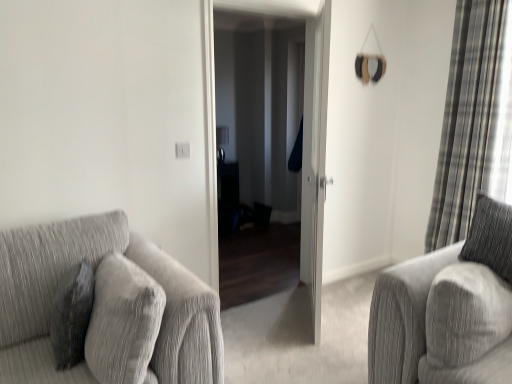
Identify the location of velvet dark gray pillow at left. (72, 315).

Image resolution: width=512 pixels, height=384 pixels. What do you see at coordinates (314, 157) in the screenshot?
I see `white glossy door at center, placed as the first screen door when sorted from right to left` at bounding box center [314, 157].

Where is `matte black screen door at center, the second screen door viewed from the right`? This screenshot has height=384, width=512. matte black screen door at center, the second screen door viewed from the right is located at coordinates (274, 7).

Measure the distance between matte black screen door at center, arranged as the 1th screen door when viewed from the left, and camera.

The depth of matte black screen door at center, arranged as the 1th screen door when viewed from the left, is 2.45 meters.

In order to face plaid fabric curtain at right, should I rotate leftwards or rightwards?

It's best to rotate right around 26.201 degrees.

What are the coordinates of `velvet dark gray pillow at left` in the screenshot? It's located at (72, 315).

Considering the sizes of objects velvet dark gray pillow at left and white glossy door at center, placed as the first screen door when sorted from right to left, in the image provided, who is bigger, velvet dark gray pillow at left or white glossy door at center, placed as the first screen door when sorted from right to left,?

Bigger between the two is white glossy door at center, placed as the first screen door when sorted from right to left.

Is white glossy door at center, placed as the second screen door when sorted from left to right, at the back of velvet dark gray pillow at left?

Yes, velvet dark gray pillow at left is facing away from white glossy door at center, placed as the second screen door when sorted from left to right.

From the image's perspective, is velvet dark gray pillow at left located beneath white glossy door at center, placed as the first screen door when sorted from right to left?

Yes.

From a real-world perspective, is velvet dark gray pillow at left positioned above or below white glossy door at center, placed as the first screen door when sorted from right to left?

velvet dark gray pillow at left is below white glossy door at center, placed as the first screen door when sorted from right to left.

From a real-world perspective, does white glossy door at center, placed as the second screen door when sorted from left to right, stand above plaid fabric curtain at right?

No, from a real-world perspective, white glossy door at center, placed as the second screen door when sorted from left to right, is not on top of plaid fabric curtain at right.

Is white glossy door at center, placed as the second screen door when sorted from left to right, to the right of plaid fabric curtain at right from the viewer's perspective?

No, white glossy door at center, placed as the second screen door when sorted from left to right, is not to the right of plaid fabric curtain at right.

Can you tell me how much white glossy door at center, placed as the second screen door when sorted from left to right, and plaid fabric curtain at right differ in facing direction?

The angle between the facing direction of white glossy door at center, placed as the second screen door when sorted from left to right, and the facing direction of plaid fabric curtain at right is 35.5 degrees.

Does matte black screen door at center, the second screen door viewed from the right, have a lesser height compared to velvet dark gray pillow at left?

In fact, matte black screen door at center, the second screen door viewed from the right, may be taller than velvet dark gray pillow at left.

The height and width of the screenshot is (384, 512). I want to click on pillow below the matte black screen door at center, arranged as the 1th screen door when viewed from the left (from a real-world perspective), so pos(72,315).

Does point (311, 21) come closer to viewer compared to point (78, 336)?

No, (311, 21) is further to viewer.

Is matte black screen door at center, arranged as the 1th screen door when viewed from the left, smaller than velvet dark gray pillow at left?

No, matte black screen door at center, arranged as the 1th screen door when viewed from the left, is not smaller than velvet dark gray pillow at left.

What's the angular difference between velvet dark gray pillow at left and plaid fabric curtain at right's facing directions?

The angular difference between velvet dark gray pillow at left and plaid fabric curtain at right is 9.28 degrees.

Is point (69, 277) farther from camera compared to point (461, 222)?

No, (69, 277) is closer to viewer.

Based on the photo, from the image's perspective, relative to plaid fabric curtain at right, is velvet dark gray pillow at left above or below?

velvet dark gray pillow at left is situated lower than plaid fabric curtain at right in the image.

Would you say velvet dark gray pillow at left is to the left or to the right of plaid fabric curtain at right in the picture?

Clearly, velvet dark gray pillow at left is on the left of plaid fabric curtain at right in the image.

Is plaid fabric curtain at right facing towards white glossy door at center, placed as the second screen door when sorted from left to right?

Yes, plaid fabric curtain at right is aimed at white glossy door at center, placed as the second screen door when sorted from left to right.

Which is closer to the camera, (473,60) or (302,227)?

Point (473,60) is positioned closer to the camera compared to point (302,227).

Is plaid fabric curtain at right next to white glossy door at center, placed as the first screen door when sorted from right to left, and touching it?

No, plaid fabric curtain at right is not making contact with white glossy door at center, placed as the first screen door when sorted from right to left.

From the image's perspective, which object appears higher, plaid fabric curtain at right or white glossy door at center, placed as the first screen door when sorted from right to left?

plaid fabric curtain at right appears higher in the image.

From the image's perspective, is plaid fabric curtain at right on velvet dark gray pillow at left?

Yes, from the image's perspective, plaid fabric curtain at right is over velvet dark gray pillow at left.

Is plaid fabric curtain at right wider or thinner than velvet dark gray pillow at left?

In the image, plaid fabric curtain at right appears to be wider than velvet dark gray pillow at left.

Is velvet dark gray pillow at left inside plaid fabric curtain at right?

No.

What's the angular difference between plaid fabric curtain at right and velvet dark gray pillow at left's facing directions?

They differ by 9.28 degrees in their facing directions.

Is white glossy door at center, placed as the first screen door when sorted from right to left, situated inside matte black screen door at center, arranged as the 1th screen door when viewed from the left, or outside?

white glossy door at center, placed as the first screen door when sorted from right to left, is outside matte black screen door at center, arranged as the 1th screen door when viewed from the left.

Looking at this image, is white glossy door at center, placed as the second screen door when sorted from left to right, bigger than matte black screen door at center, the second screen door viewed from the right?

No.

How different are the orientations of white glossy door at center, placed as the first screen door when sorted from right to left, and matte black screen door at center, arranged as the 1th screen door when viewed from the left, in degrees?

They differ by 129 degrees in their facing directions.

From the picture: Is white glossy door at center, placed as the first screen door when sorted from right to left, not near matte black screen door at center, arranged as the 1th screen door when viewed from the left?

That's not correct — white glossy door at center, placed as the first screen door when sorted from right to left, is a little close to matte black screen door at center, arranged as the 1th screen door when viewed from the left.

Where is `pillow located in front of the white glossy door at center, placed as the second screen door when sorted from left to right`? The width and height of the screenshot is (512, 384). pillow located in front of the white glossy door at center, placed as the second screen door when sorted from left to right is located at coordinates (72, 315).

I want to click on the 2nd screen door below the plaid fabric curtain at right (from the image's perspective), so click(x=314, y=157).

Which object lies nearer to the anchor point plaid fabric curtain at right, white glossy door at center, placed as the first screen door when sorted from right to left, or velvet dark gray pillow at left?

white glossy door at center, placed as the first screen door when sorted from right to left, is closer to plaid fabric curtain at right.

Based on their spatial positions, is plaid fabric curtain at right or matte black screen door at center, the second screen door viewed from the right, closer to white glossy door at center, placed as the second screen door when sorted from left to right?

Based on the image, matte black screen door at center, the second screen door viewed from the right, appears to be nearer to white glossy door at center, placed as the second screen door when sorted from left to right.

Estimate the real-world distances between objects in this image. Which object is closer to textured gray couch at left, white glossy door at center, placed as the second screen door when sorted from left to right, or matte black screen door at center, the second screen door viewed from the right?

white glossy door at center, placed as the second screen door when sorted from left to right.

Based on their spatial positions, is textured gray couch at left or white glossy door at center, placed as the first screen door when sorted from right to left, further from plaid fabric curtain at right?

textured gray couch at left is positioned further to the anchor plaid fabric curtain at right.

Considering their positions, is textured gray couch at left positioned closer to plaid fabric curtain at right than matte black screen door at center, the second screen door viewed from the right?

The object closer to plaid fabric curtain at right is matte black screen door at center, the second screen door viewed from the right.

From the image, which object appears to be farther from white glossy door at center, placed as the second screen door when sorted from left to right, matte black screen door at center, the second screen door viewed from the right, or plaid fabric curtain at right?

plaid fabric curtain at right.

Based on their spatial positions, is white glossy door at center, placed as the first screen door when sorted from right to left, or velvet dark gray pillow at left further from matte black screen door at center, arranged as the 1th screen door when viewed from the left?

velvet dark gray pillow at left is further to matte black screen door at center, arranged as the 1th screen door when viewed from the left.

Based on their spatial positions, is textured gray couch at left or velvet dark gray pillow at left further from plaid fabric curtain at right?

velvet dark gray pillow at left is positioned further to the anchor plaid fabric curtain at right.

Locate an element on the screen. pillow between textured gray couch at left and matte black screen door at center, arranged as the 1th screen door when viewed from the left, from front to back is located at coordinates (72, 315).

Where is `studio couch between velvet dark gray pillow at left and plaid fabric curtain at right from left to right`? This screenshot has width=512, height=384. studio couch between velvet dark gray pillow at left and plaid fabric curtain at right from left to right is located at coordinates (106, 308).

The height and width of the screenshot is (384, 512). In order to click on screen door situated between matte black screen door at center, the second screen door viewed from the right, and plaid fabric curtain at right from left to right in this screenshot , I will do `click(314, 157)`.

This screenshot has height=384, width=512. Identify the location of screen door between velvet dark gray pillow at left and white glossy door at center, placed as the second screen door when sorted from left to right, in the horizontal direction. (274, 7).